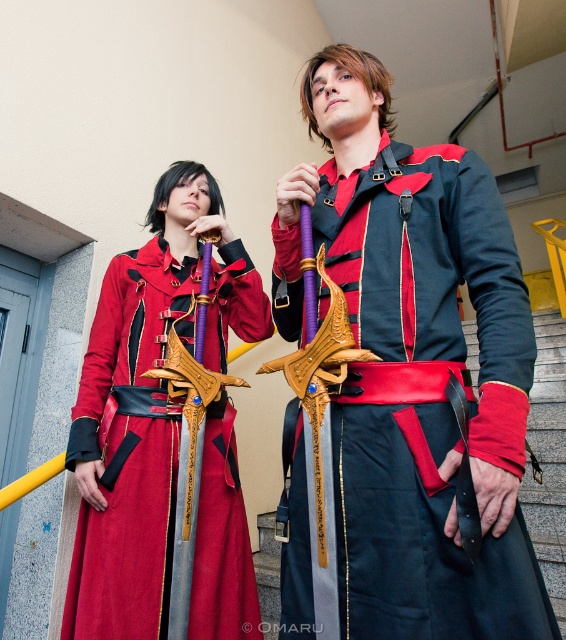
You are a photographer positioned at the entrance of the convention hall. You need to capture a photo of the matte black sword at center without including the individuals in the background. Is the sword positioned in a way that allows you to frame it without the people behind it?

The matte black sword at center is located at point (426,396), which means it is positioned in the lower right area of the image. Since the individuals are standing near the staircase and the sword is centrally placed, you can adjust your angle to frame the sword without including the people behind it.

You are standing in the convention center and see the matte black sword at center and the satin red dress at center. Which object is positioned to the right of the other?

The matte black sword at center is to the right of the satin red dress at center.

You are organizing a photo shoot and need to position the matte black sword at center and the satin red dress at center in a way that they both fit within a 3x3 meter frame. Based on their sizes, which object should be placed closer to the edges to ensure they both fit?

The matte black sword at center occupies less space than the satin red dress at center, so the satin red dress at center should be placed closer to the edges to accommodate its larger size within the frame.